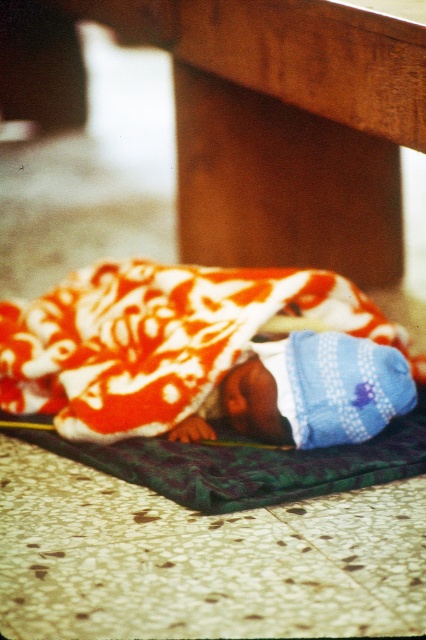
Based on the photo, can you confirm if brown wood table at lower center is bigger than blue knitted hat at lower center?

Indeed, brown wood table at lower center has a larger size compared to blue knitted hat at lower center.

Based on the photo, does brown wood table at lower center have a lesser height compared to blue knitted hat at lower center?

Incorrect, brown wood table at lower center's height does not fall short of blue knitted hat at lower center's.

Is point (302, 184) farther from camera compared to point (229, 403)?

Yes, point (302, 184) is farther from viewer.

Locate an element on the screen. Image resolution: width=426 pixels, height=640 pixels. brown wood table at lower center is located at coordinates (253, 116).

Which is below, floral cotton blanket at lower center or blue knitted hat at lower center?

blue knitted hat at lower center is below.

The image size is (426, 640). Identify the location of floral cotton blanket at lower center. (206, 355).

Is point (278, 227) more distant than point (184, 307)?

Yes, it is.

Between brown wood table at lower center and floral cotton blanket at lower center, which one is positioned higher?

brown wood table at lower center is higher up.

Where is `brown wood table at lower center`? brown wood table at lower center is located at coordinates (253, 116).